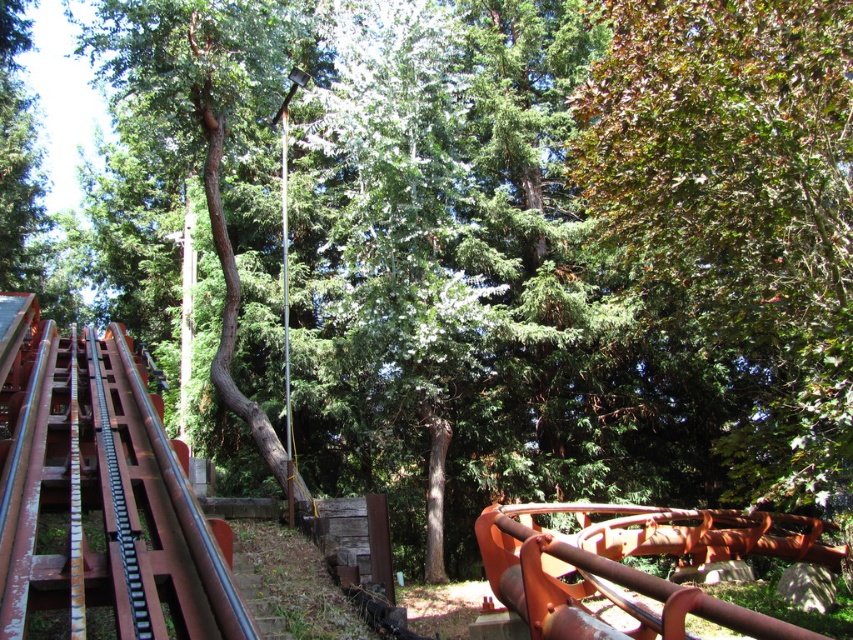
Question: Among these objects, which one is nearest to the camera?

Choices:
 (A) green rough bark tree at center
 (B) green leafy tree at upper right

Answer: (A)

Question: Can you confirm if green rough bark tree at center is thinner than rusty metal roller coaster rail at lower right?

Choices:
 (A) no
 (B) yes

Answer: (A)

Question: Is green leafy tree at upper right further to camera compared to rusty metal roller coaster rail at lower right?

Choices:
 (A) yes
 (B) no

Answer: (A)

Question: Which point is farther to the camera?

Choices:
 (A) (236, 93)
 (B) (848, 74)

Answer: (A)

Question: Is green leafy tree at upper right wider than rusty metal train track at left?

Choices:
 (A) no
 (B) yes

Answer: (B)

Question: Which point appears closest to the camera in this image?

Choices:
 (A) (215, 230)
 (B) (85, 456)
 (C) (793, 340)
 (D) (733, 624)

Answer: (D)